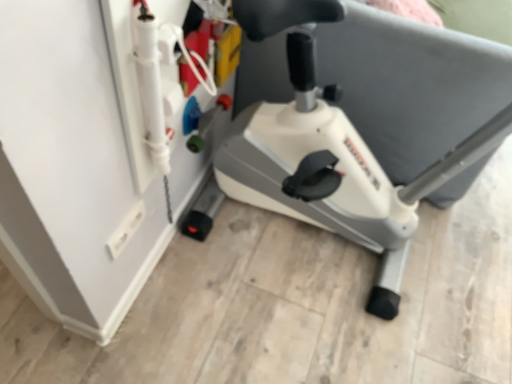
The width and height of the screenshot is (512, 384). What do you see at coordinates (126, 229) in the screenshot?
I see `white plastic electric outlet at lower left` at bounding box center [126, 229].

Where is `white plastic electric outlet at lower left`? white plastic electric outlet at lower left is located at coordinates (126, 229).

What is the approximate height of white plastic electric outlet at lower left?

white plastic electric outlet at lower left is 3.46 inches in height.

What do you see at coordinates (359, 153) in the screenshot? I see `white plastic stationary bicycle at center` at bounding box center [359, 153].

The height and width of the screenshot is (384, 512). I want to click on white plastic stationary bicycle at center, so click(x=359, y=153).

At what (x,y) coordinates should I click in order to perform the action: click on white plastic electric outlet at lower left. Please return your answer as a coordinate pair (x, y). This screenshot has width=512, height=384. Looking at the image, I should click on (126, 229).

Considering the relative positions of white plastic electric outlet at lower left and white plastic stationary bicycle at center in the image provided, is white plastic electric outlet at lower left to the right of white plastic stationary bicycle at center from the viewer's perspective?

No, white plastic electric outlet at lower left is not to the right of white plastic stationary bicycle at center.

Consider the image. Is white plastic electric outlet at lower left further to the viewer compared to white plastic stationary bicycle at center?

Yes, white plastic electric outlet at lower left is further from the camera.

Does point (132, 214) come behind point (320, 172)?

That is False.

From the image's perspective, is white plastic electric outlet at lower left below white plastic stationary bicycle at center?

Yes.

Looking at this image, from a real-world perspective, relative to white plastic stationary bicycle at center, is white plastic electric outlet at lower left vertically above or below?

white plastic electric outlet at lower left is situated lower than white plastic stationary bicycle at center in the real world.

Is white plastic electric outlet at lower left thinner than white plastic stationary bicycle at center?

Indeed, white plastic electric outlet at lower left has a lesser width compared to white plastic stationary bicycle at center.

Who is shorter, white plastic electric outlet at lower left or white plastic stationary bicycle at center?

white plastic electric outlet at lower left is shorter.

Between white plastic electric outlet at lower left and white plastic stationary bicycle at center, which one has larger size?

white plastic stationary bicycle at center.

Choose the correct answer: Is white plastic electric outlet at lower left inside white plastic stationary bicycle at center or outside it?

white plastic electric outlet at lower left cannot be found inside white plastic stationary bicycle at center.

Are white plastic electric outlet at lower left and white plastic stationary bicycle at center far apart?

No, white plastic electric outlet at lower left is in close proximity to white plastic stationary bicycle at center.

Is white plastic electric outlet at lower left oriented away from white plastic stationary bicycle at center?

No, white plastic electric outlet at lower left is not facing the opposite direction of white plastic stationary bicycle at center.

This screenshot has width=512, height=384. Identify the location of electric outlet lying behind the white plastic stationary bicycle at center. (126, 229).

Considering the relative positions of white plastic stationary bicycle at center and white plastic electric outlet at lower left in the image provided, is white plastic stationary bicycle at center to the left of white plastic electric outlet at lower left from the viewer's perspective?

In fact, white plastic stationary bicycle at center is to the right of white plastic electric outlet at lower left.

Considering the positions of objects white plastic stationary bicycle at center and white plastic electric outlet at lower left in the image provided, who is behind, white plastic stationary bicycle at center or white plastic electric outlet at lower left?

white plastic electric outlet at lower left is further away from the camera.

Considering the points (295, 55) and (108, 243), which point is in front, point (295, 55) or point (108, 243)?

Positioned in front is point (108, 243).

From the image's perspective, which is above, white plastic stationary bicycle at center or white plastic electric outlet at lower left?

white plastic stationary bicycle at center appears higher in the image.

From a real-world perspective, which object stands above the other?

white plastic stationary bicycle at center.

Is white plastic stationary bicycle at center wider than white plastic electric outlet at lower left?

Correct, the width of white plastic stationary bicycle at center exceeds that of white plastic electric outlet at lower left.

Considering the relative sizes of white plastic stationary bicycle at center and white plastic electric outlet at lower left in the image provided, is white plastic stationary bicycle at center shorter than white plastic electric outlet at lower left?

No.

Does white plastic stationary bicycle at center have a smaller size compared to white plastic electric outlet at lower left?

No, white plastic stationary bicycle at center is not smaller than white plastic electric outlet at lower left.

Is white plastic electric outlet at lower left surrounded by white plastic stationary bicycle at center?

Actually, white plastic electric outlet at lower left is outside white plastic stationary bicycle at center.

Are white plastic stationary bicycle at center and white plastic electric outlet at lower left making contact?

No, white plastic stationary bicycle at center is not beside white plastic electric outlet at lower left.

Is white plastic stationary bicycle at center oriented away from white plastic electric outlet at lower left?

No, white plastic electric outlet at lower left is not at the back of white plastic stationary bicycle at center.

Looking at this image, how different are the orientations of white plastic stationary bicycle at center and white plastic electric outlet at lower left in degrees?

There is a 0.952-degree angle between the facing directions of white plastic stationary bicycle at center and white plastic electric outlet at lower left.

At what (x,y) coordinates should I click in order to perform the action: click on electric outlet below the white plastic stationary bicycle at center (from a real-world perspective). Please return your answer as a coordinate pair (x, y). Looking at the image, I should click on 126,229.

This screenshot has width=512, height=384. I want to click on stationary bicycle located above the white plastic electric outlet at lower left (from the image's perspective), so point(359,153).

Where is `electric outlet lying below the white plastic stationary bicycle at center (from the image's perspective)`? The height and width of the screenshot is (384, 512). electric outlet lying below the white plastic stationary bicycle at center (from the image's perspective) is located at coordinates (126, 229).